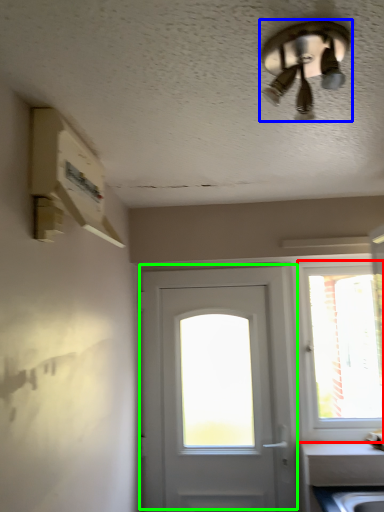
Question: Estimate the real-world distances between objects in this image. Which object is farther from window (highlighted by a red box), ceiling fan (highlighted by a blue box) or door (highlighted by a green box)?

Choices:
 (A) ceiling fan
 (B) door

Answer: (A)